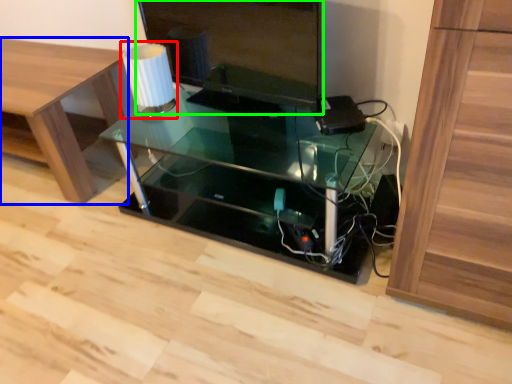
Question: Considering the real-world distances, which object is farthest from table lamp (highlighted by a red box)? furniture (highlighted by a blue box) or computer monitor (highlighted by a green box)?

Choices:
 (A) furniture
 (B) computer monitor

Answer: (A)